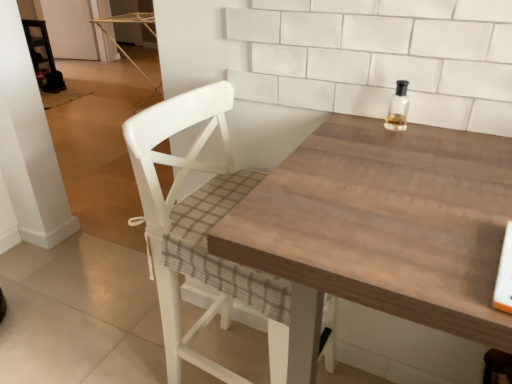
Locate an element on the screen. vacant area that is in front of clear glass bottle at upper right is located at coordinates (416, 158).